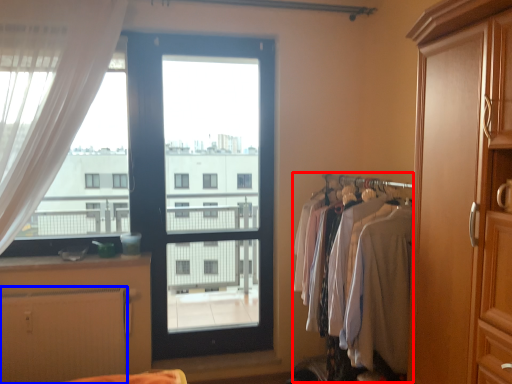
Question: Which of the following is the farthest to the observer, laundry (highlighted by a red box) or radiator (highlighted by a blue box)?

Choices:
 (A) laundry
 (B) radiator

Answer: (B)